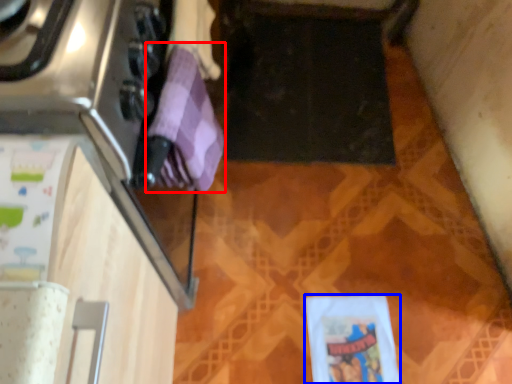
Question: Which object is further to the camera taking this photo, wrapping paper (highlighted by a red box) or wrapping paper (highlighted by a blue box)?

Choices:
 (A) wrapping paper
 (B) wrapping paper

Answer: (B)